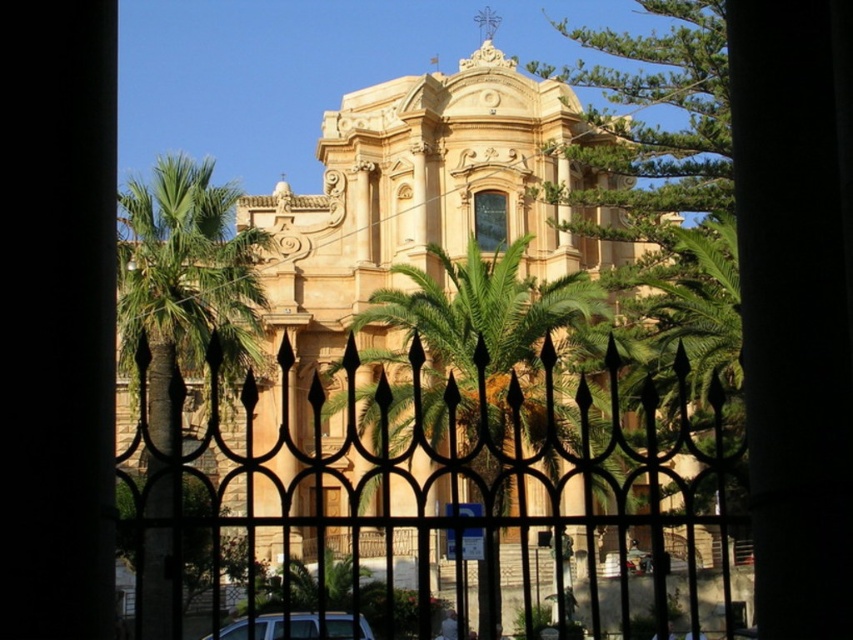
Can you confirm if green leafy palm tree at center is thinner than silver metallic car at lower center?

No.

Does point (561, 388) lie behind point (225, 628)?

Yes, it is behind point (225, 628).

Identify the location of green leafy palm tree at center. (486, 337).

The width and height of the screenshot is (853, 640). What are the coordinates of `green leafy palm tree at center` in the screenshot? It's located at (486, 337).

Can you confirm if green leafy palm tree at center is shorter than green leafy tree at upper right?

Yes, green leafy palm tree at center is shorter than green leafy tree at upper right.

Measure the distance between green leafy palm tree at center and camera.

green leafy palm tree at center and camera are 153.45 feet apart from each other.

Locate an element on the screen. The image size is (853, 640). green leafy palm tree at center is located at coordinates (486, 337).

Does black wrought iron fence at center appear on the left side of green leafy tree at upper right?

Indeed, black wrought iron fence at center is positioned on the left side of green leafy tree at upper right.

Which of these two, black wrought iron fence at center or green leafy tree at upper right, stands taller?

With more height is green leafy tree at upper right.

Between point (679, 355) and point (637, 38), which one is positioned behind?

Point (637, 38)

Locate an element on the screen. black wrought iron fence at center is located at coordinates (444, 493).